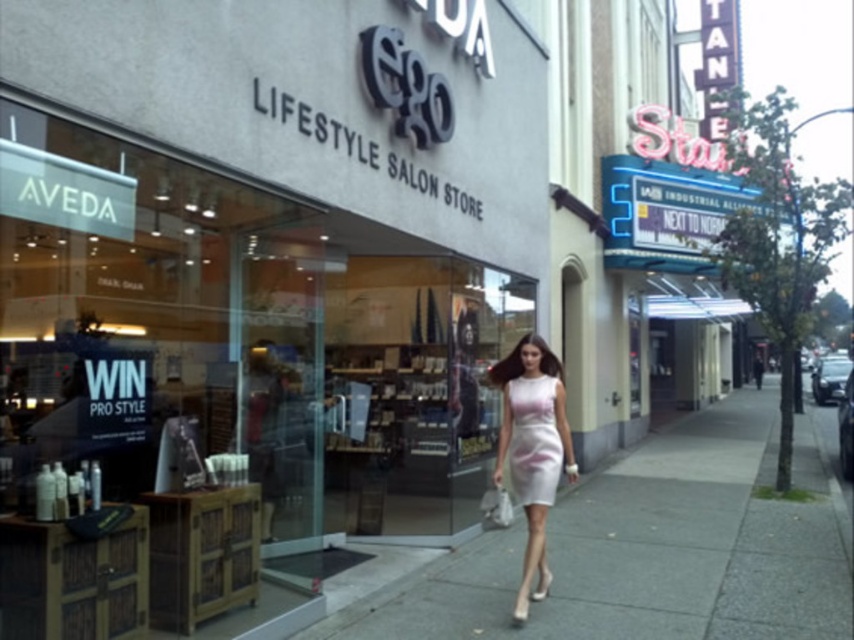
From the picture: Who is positioned more to the left, white smooth pavement at center or white satin dress at center?

white satin dress at center

Is point (810, 560) farther from camera compared to point (528, 592)?

Yes, it is behind point (528, 592).

Who is more distant from viewer, (x=320, y=634) or (x=563, y=454)?

The point (x=563, y=454) is behind.

Locate an element on the screen. The width and height of the screenshot is (854, 640). white smooth pavement at center is located at coordinates (650, 548).

Between white smooth pavement at center and pale pink satin dress at center, which one is positioned higher?

pale pink satin dress at center is higher up.

Is white smooth pavement at center taller than pale pink satin dress at center?

No, white smooth pavement at center is not taller than pale pink satin dress at center.

Image resolution: width=854 pixels, height=640 pixels. In order to click on white smooth pavement at center in this screenshot , I will do `click(650, 548)`.

Which is in front, point (383, 307) or point (540, 465)?

Point (540, 465) is in front.

Between matte black sign at upper center and pale pink satin dress at center, which one has less height?

With less height is matte black sign at upper center.

Is point (9, 172) farther from viewer compared to point (521, 404)?

No.

Where is `matte black sign at upper center`? This screenshot has width=854, height=640. matte black sign at upper center is located at coordinates (268, 248).